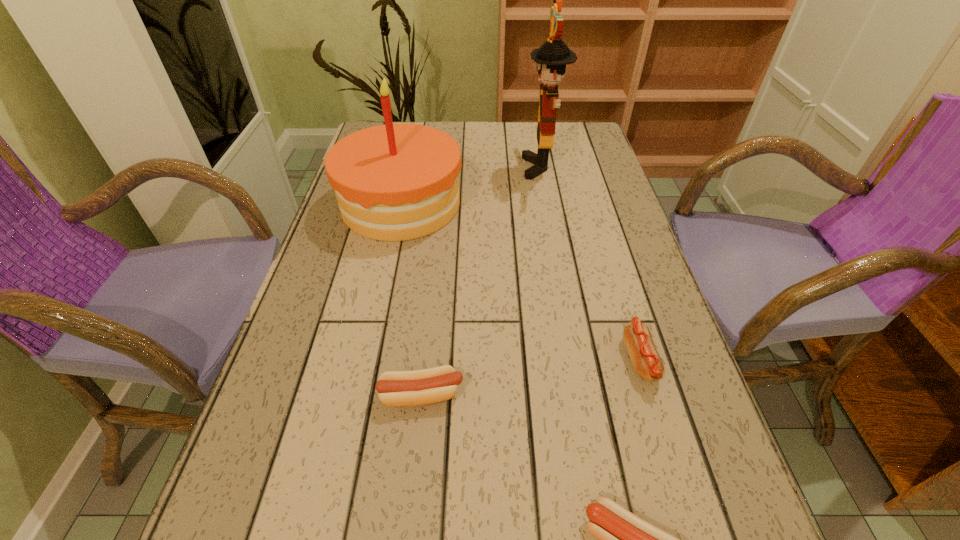
You are a GUI agent. You are given a task and a screenshot of the screen. Output one action in this format:
    pyautogui.click(x=<x>, y=<y>)
    Task: Click on the nutcracker located in the right edge section of the desktop
    
    Given the screenshot: What is the action you would take?
    pyautogui.click(x=551, y=58)

At what (x,y) coordinates should I click in order to perform the action: click on sausage positioned at the right edge. Please return your answer as a coordinate pair (x, y). The image size is (960, 540). Looking at the image, I should click on (637, 337).

Image resolution: width=960 pixels, height=540 pixels. I want to click on object that is at the far right corner, so click(551, 58).

In the image, there is a desktop. Identify the location of vacant space at the right edge. (592, 177).

Identify the location of free space at the far right corner of the desktop. The image size is (960, 540). (588, 138).

What are the coordinates of `vacant space that's between the leftmost sausage and the second tallest object` in the screenshot? It's located at (412, 299).

The image size is (960, 540). In order to click on vacant area between the fourth shortest object and the leftmost sausage in this screenshot , I will do `click(412, 299)`.

Image resolution: width=960 pixels, height=540 pixels. In order to click on vacant area that lies between the nutcracker and the leftmost sausage in this screenshot , I will do `click(482, 281)`.

Find the location of a particular element. Image resolution: width=960 pixels, height=540 pixels. vacant region between the birthday cake and the leftmost sausage is located at coordinates (412, 299).

Locate an element on the screen. This screenshot has width=960, height=540. unoccupied position between the nutcracker and the fourth shortest object is located at coordinates (471, 186).